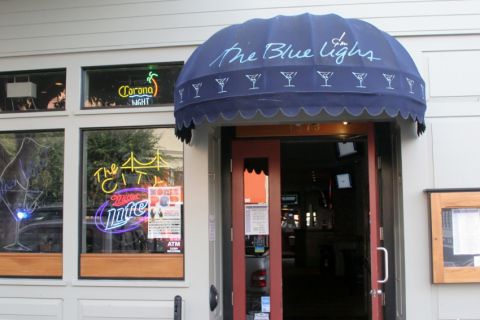
Find the location of a particular element. glass is located at coordinates (467, 246).